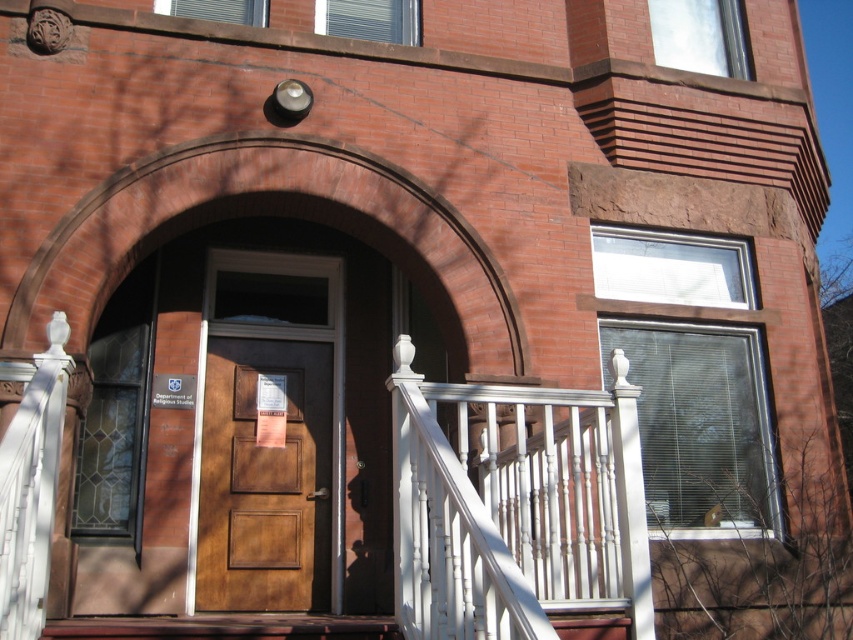
You are a delivery person with a large box that needs to be carried up the stairs. The box is 1.2 meters wide. Can you safely carry it up the wooden stairs at center while avoiding the white painted wood balustrade at lower center?

The white painted wood balustrade at lower center is thinner than the wooden stairs at center. Since the balustrade is thinner, there should be enough space to safely carry the 1.2 meter wide box up the wooden stairs at center while avoiding the balustrade.

You are a delivery person trying to reach the brown wood door at center. The white painted wood porch at center is blocking your path. Can you go around it to reach the door?

The white painted wood porch at center is in front of brown wood door at center, so you can go around it to reach the door since it is blocking the direct path.

You are a delivery person approaching the entrance of the brick building. You need to place a package on the white painted wood porch at center and secure it near the white painted wood balustrade at lower center. Based on their positions, can you determine which object is on the right side when facing the entrance?

The white painted wood porch at center is positioned on the right side of the white painted wood balustrade at lower center, so when facing the entrance, the white painted wood porch at center is on the right side.